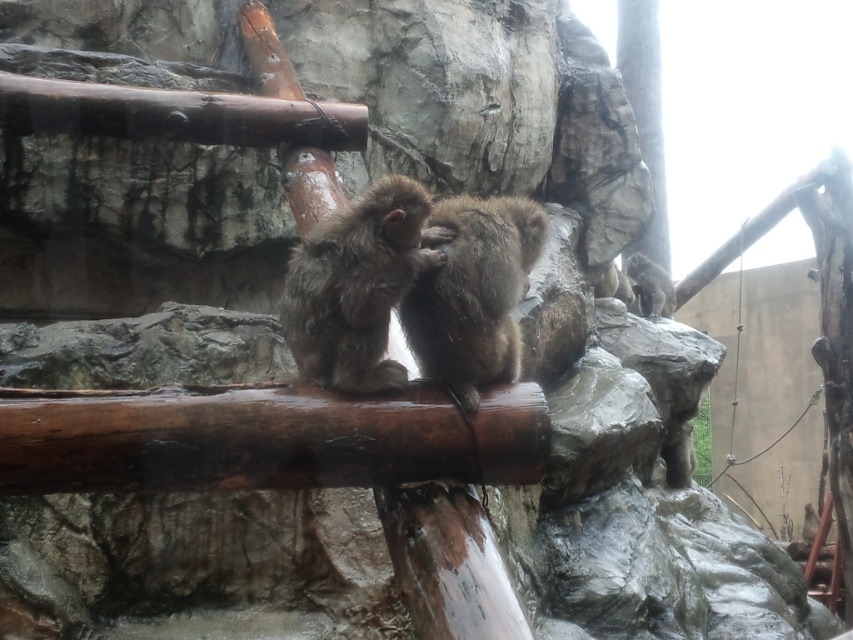
Is brown furry monkey at center smaller than fuzzy brown monkey at upper right?

Yes, brown furry monkey at center is smaller than fuzzy brown monkey at upper right.

Is brown furry monkey at center to the left of fuzzy brown monkey at upper right from the viewer's perspective?

Yes, brown furry monkey at center is to the left of fuzzy brown monkey at upper right.

Find the location of `brown furry monkey at center`. brown furry monkey at center is located at coordinates (357, 285).

Is brown furry monkey at center below fuzzy brown monkey at center?

Yes.

Which is below, brown furry monkey at center or fuzzy brown monkey at center?

brown furry monkey at center is below.

The height and width of the screenshot is (640, 853). Describe the element at coordinates (357, 285) in the screenshot. I see `brown furry monkey at center` at that location.

Locate an element on the screen. brown furry monkey at center is located at coordinates (357, 285).

Is fuzzy brown monkey at center further to the viewer compared to fuzzy brown monkey at upper right?

No, it is not.

Which is behind, point (473, 246) or point (625, 260)?

Positioned behind is point (625, 260).

What do you see at coordinates (474, 292) in the screenshot? This screenshot has height=640, width=853. I see `fuzzy brown monkey at center` at bounding box center [474, 292].

You are a GUI agent. You are given a task and a screenshot of the screen. Output one action in this format:
    pyautogui.click(x=<x>, y=<y>)
    Task: Click on the fuzzy brown monkey at center
    The height and width of the screenshot is (640, 853).
    Given the screenshot: What is the action you would take?
    pyautogui.click(x=474, y=292)